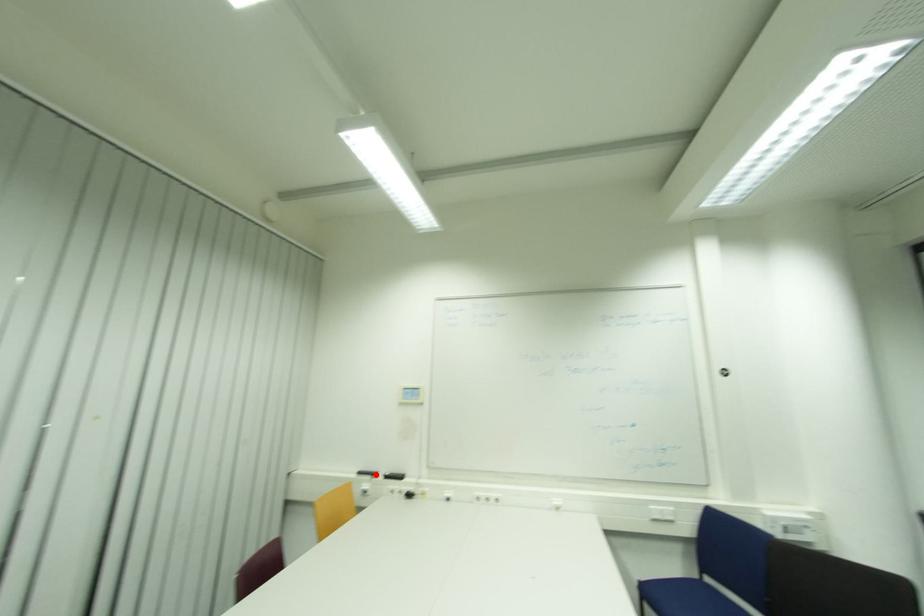
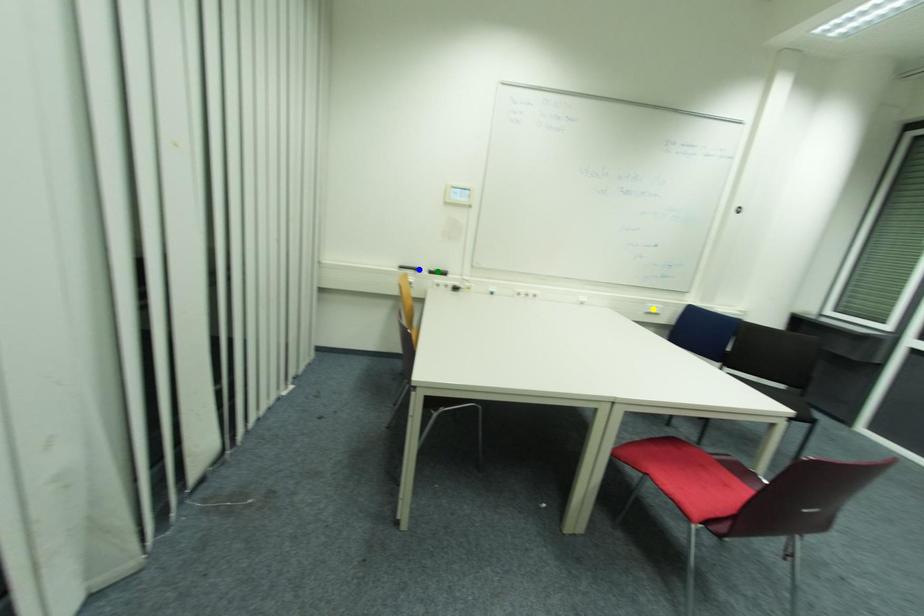
Question: I am providing you with two images of the same scene from different viewpoints. A red point is marked on the first image. You are given multiple points on the second image. Can you choose the point in image 2 that corresponds to the point in image 1?

Choices:
 (A) green point
 (B) yellow point
 (C) blue point

Answer: (C)